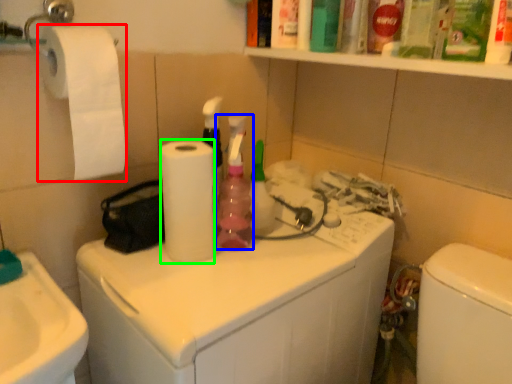
Question: Estimate the real-world distances between objects in this image. Which object is closer to toilet paper (highlighted by a red box), cleaning product (highlighted by a blue box) or paper towel (highlighted by a green box)?

Choices:
 (A) cleaning product
 (B) paper towel

Answer: (B)